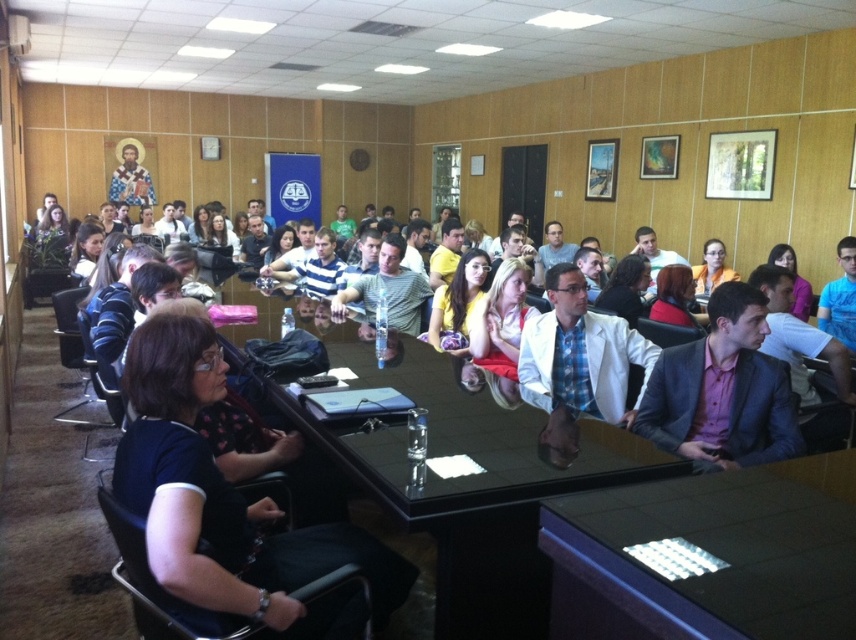
You are standing in the conference room and want to locate the white matte blazer at center. According to the coordinates provided, where would you find it?

The white matte blazer at center is located at coordinates point (581, 353).

You are attending a formal meeting in the conference room and notice the black glossy table at center and the yellow fabric dress at center. Which object is closer to the ceiling?

The black glossy table at center is positioned under the yellow fabric dress at center, so the yellow fabric dress at center is closer to the ceiling.

You are attending a formal meeting in the conference room. You need to place a document on the black glossy table at center and hand it to the person wearing the yellow fabric dress at center. Which direction should you move the document from the table to reach the person?

The black glossy table at center is to the left of the yellow fabric dress at center, so you should move the document to the right to reach the person wearing the yellow fabric dress at center.